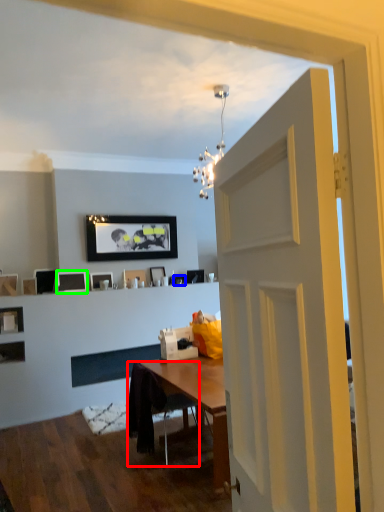
Question: Which object is positioned closest to chair (highlighted by a red box)? Select from picture frame (highlighted by a blue box) and picture frame (highlighted by a green box).

Choices:
 (A) picture frame
 (B) picture frame

Answer: (B)